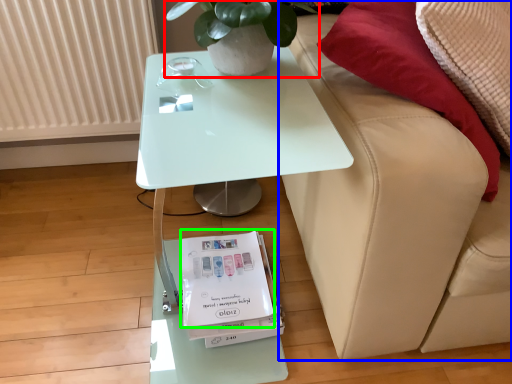
Question: Which object is positioned farthest from houseplant (highlighted by a red box)? Select from studio couch (highlighted by a blue box) and magazine (highlighted by a green box).

Choices:
 (A) studio couch
 (B) magazine

Answer: (B)